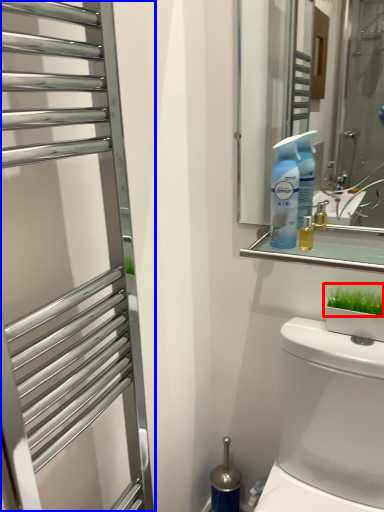
Question: Which point is further to the camera, plant (highlighted by a red box) or screen door (highlighted by a blue box)?

Choices:
 (A) plant
 (B) screen door

Answer: (A)